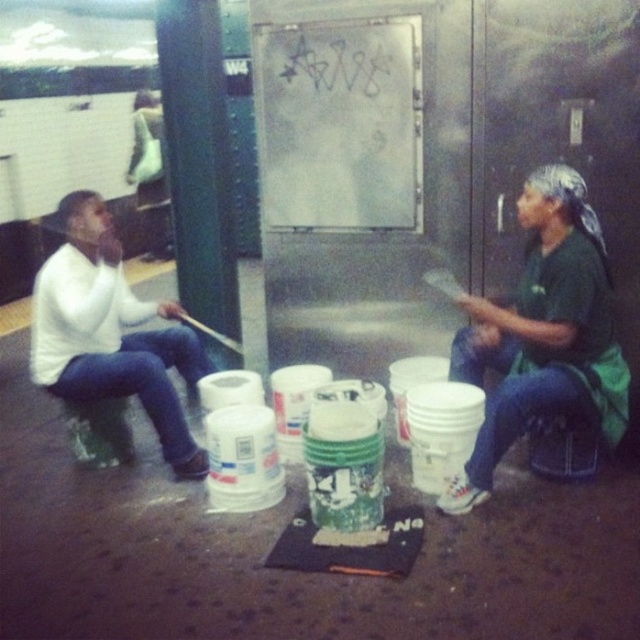
You are a photographer trying to capture both the green fabric shirt at right and the white matte sweater at left in a single frame. Given their sizes, which one will appear taller in the photo?

The green fabric shirt at right will appear taller in the photo because it has a greater height compared to the white matte sweater at left.

You are a photographer trying to capture both the green fabric shirt at right and the white matte sweater at left in a single frame. Based on their positions, which one should you adjust your camera angle to focus on first to ensure both are in the shot?

Since the green fabric shirt at right is to the right of the white matte sweater at left, you should adjust your camera angle to focus on the white matte sweater at left first to ensure both are included in the frame.